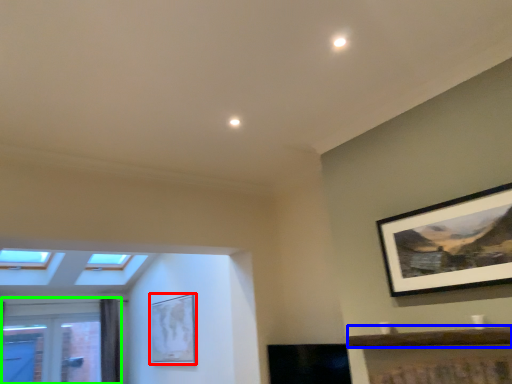
Question: Estimate the real-world distances between objects in this image. Which object is farther from picture frame (highlighted by a red box), window sill (highlighted by a blue box) or window (highlighted by a green box)?

Choices:
 (A) window sill
 (B) window

Answer: (A)